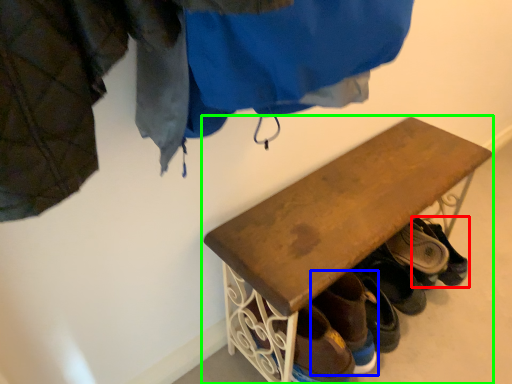
Question: Which object is the closest to the footwear (highlighted by a red box)? Choose among these: footwear (highlighted by a blue box) or furniture (highlighted by a green box).

Choices:
 (A) footwear
 (B) furniture

Answer: (A)